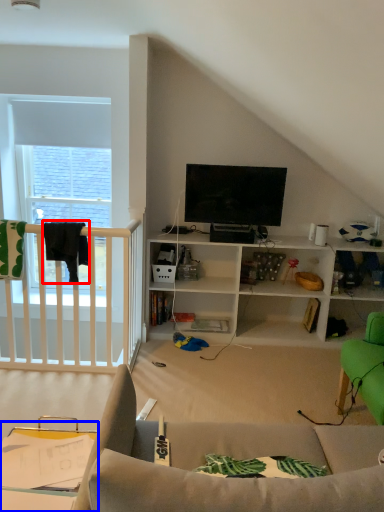
Question: Among these objects, which one is farthest to the camera, clothesline (highlighted by a red box) or table (highlighted by a blue box)?

Choices:
 (A) clothesline
 (B) table

Answer: (A)